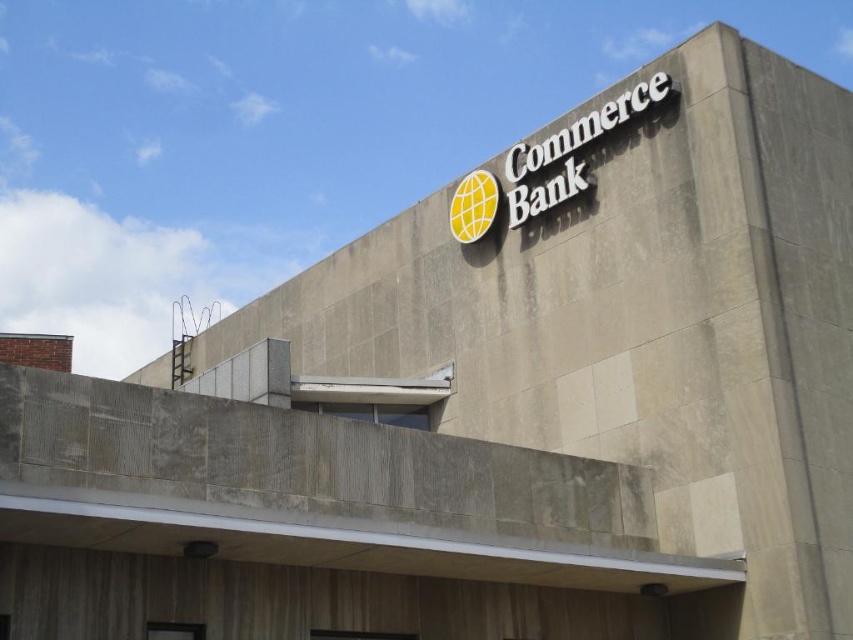
Can you confirm if white metallic sign at upper center is positioned to the right of yellow matte globe at center?

Yes, white metallic sign at upper center is to the right of yellow matte globe at center.

Is point (564, 182) in front of point (477, 240)?

Yes.

The width and height of the screenshot is (853, 640). What are the coordinates of `white metallic sign at upper center` in the screenshot? It's located at (572, 150).